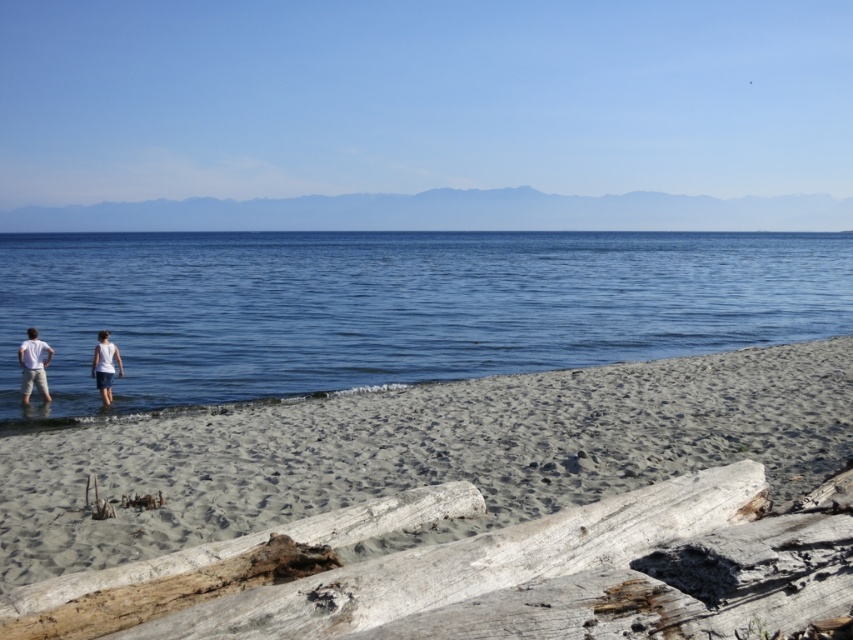
Question: Can you confirm if blue water at lower left is positioned below weathered wood log at lower center?

Choices:
 (A) no
 (B) yes

Answer: (A)

Question: Can you confirm if light beige sand at lower left is positioned above white cotton shirt at lower left?

Choices:
 (A) yes
 (B) no

Answer: (B)

Question: Which point is farther to the camera?

Choices:
 (A) weathered wood log at lower center
 (B) blue water at lower left
 (C) white cotton shirt at center

Answer: (C)

Question: Is blue water at lower left positioned behind white cotton shirt at lower left?

Choices:
 (A) no
 (B) yes

Answer: (A)

Question: Which point is closer to the camera?

Choices:
 (A) (640, 243)
 (B) (109, 369)

Answer: (B)

Question: Which of these objects is positioned closest to the light beige sand at lower left?

Choices:
 (A) weathered wood log at lower center
 (B) white cotton shirt at lower left
 (C) white cotton shirt at center
 (D) white matte shirt at lower left

Answer: (A)